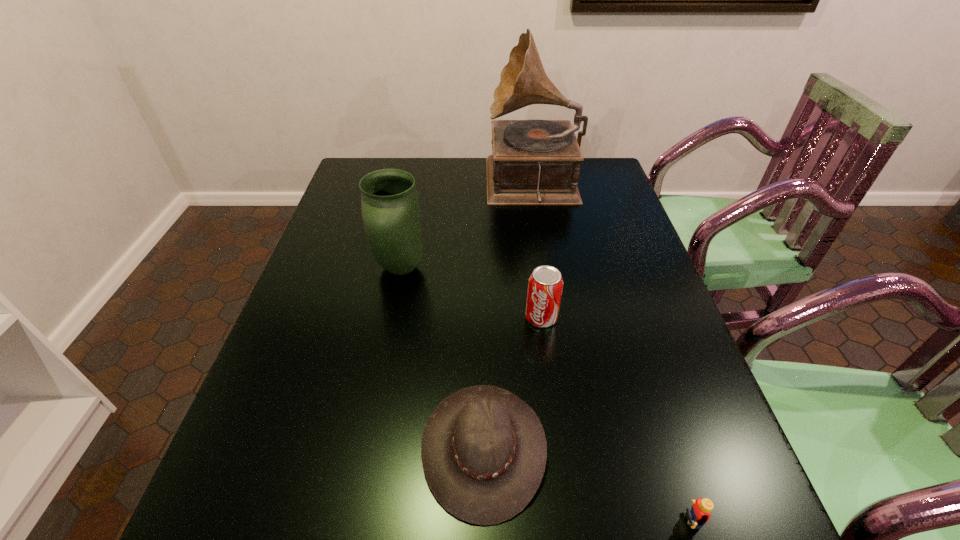
Locate an element on the screen. The width and height of the screenshot is (960, 540). free spot located from the horn of the farthest object is located at coordinates (451, 186).

At what (x,y) coordinates should I click in order to perform the action: click on free region located on the front of the vase. Please return your answer as a coordinate pair (x, y). This screenshot has height=540, width=960. Looking at the image, I should click on (366, 442).

Identify the location of free space located on the left of the third nearest object. (479, 318).

Where is `free location located on the front-facing side of the Lego`? free location located on the front-facing side of the Lego is located at coordinates (549, 521).

At what (x,y) coordinates should I click in order to perform the action: click on vacant area situated 0.050m on the front-facing side of the Lego. Please return your answer as a coordinate pair (x, y). Looking at the image, I should click on (634, 521).

Identify the location of free space located 0.260m on the front-facing side of the Lego. (507, 521).

Identify the location of vacant point located 0.320m on the front-facing side of the hat. This screenshot has width=960, height=540. (251, 448).

Find the location of a particular element. Image resolution: width=960 pixels, height=540 pixels. free space located on the front-facing side of the hat is located at coordinates (304, 448).

Where is `vacant space situated on the front-facing side of the hat`? vacant space situated on the front-facing side of the hat is located at coordinates (234, 448).

The width and height of the screenshot is (960, 540). Find the location of `object present at the far edge`. object present at the far edge is located at coordinates (534, 162).